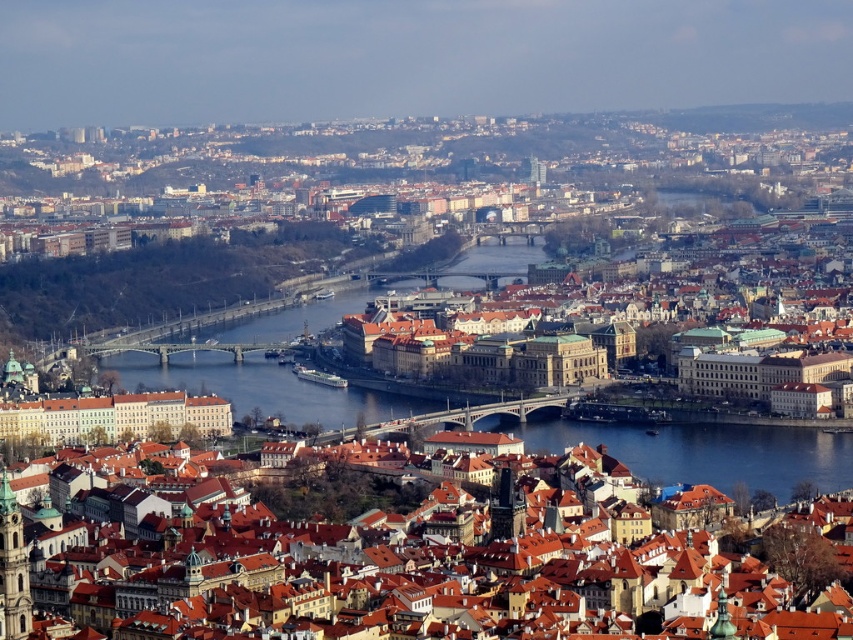
Question: From the image, what is the correct spatial relationship of clear blue water at center in relation to blue glass water at center?

Choices:
 (A) above
 (B) below

Answer: (A)

Question: Which point is farther to the camera?

Choices:
 (A) [x=633, y=429]
 (B) [x=297, y=380]

Answer: (B)

Question: Does clear blue water at center appear on the left side of blue glass water at center?

Choices:
 (A) yes
 (B) no

Answer: (A)

Question: Which object appears farthest from the camera in this image?

Choices:
 (A) clear blue water at center
 (B) blue glass water at center

Answer: (A)

Question: Does clear blue water at center appear under blue glass water at center?

Choices:
 (A) no
 (B) yes

Answer: (A)